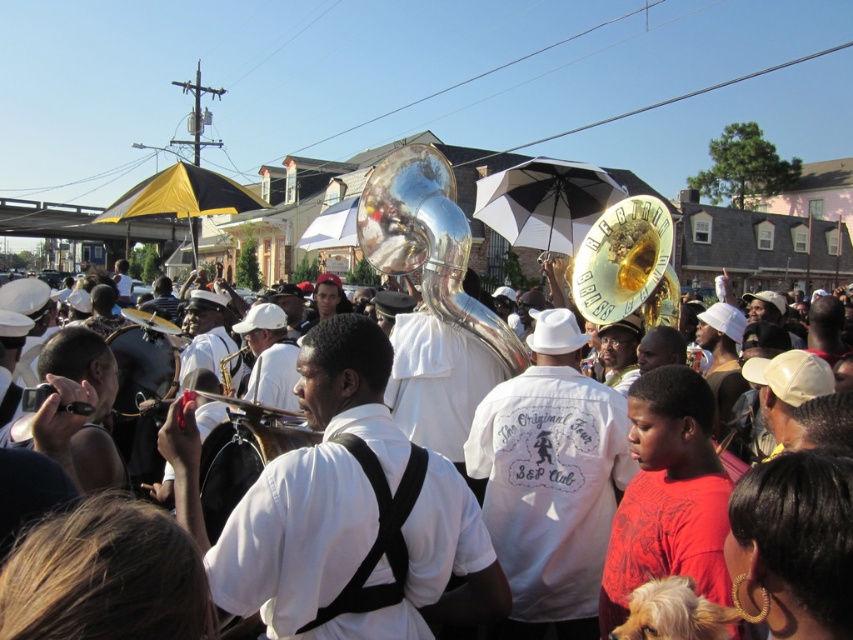
Question: From the image, what is the correct spatial relationship of white matte shirt at center in relation to gold shiny tuba at center?

Choices:
 (A) above
 (B) below

Answer: (B)

Question: Which object appears closest to the camera in this image?

Choices:
 (A) gold shiny tuba at center
 (B) black matte camera at center
 (C) white matte shirt at center

Answer: (B)

Question: Estimate the real-world distances between objects in this image. Which object is closer to the white matte shirt at center?

Choices:
 (A) black matte camera at center
 (B) white matte uniform at center
 (C) silver metallic tuba at center
 (D) gold shiny tuba at center

Answer: (C)

Question: Can you confirm if white matte shirt at center is bigger than gold shiny tuba at center?

Choices:
 (A) no
 (B) yes

Answer: (B)

Question: Does white matte uniform at center appear under silver metallic tuba at center?

Choices:
 (A) yes
 (B) no

Answer: (A)

Question: Considering the real-world distances, which object is closest to the white matte shirt at center?

Choices:
 (A) gold shiny tuba at center
 (B) silver metallic tuba at center
 (C) white matte uniform at center

Answer: (B)